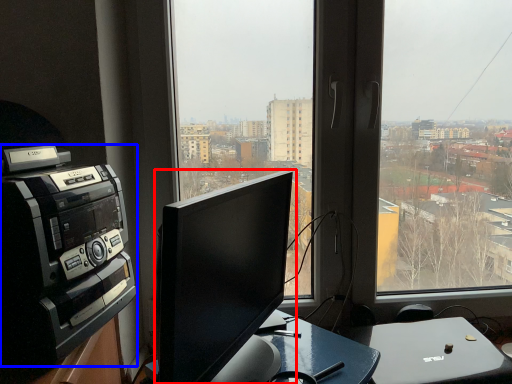
Question: Which point is closer to the camera, computer monitor (highlighted by a red box) or amplifier (highlighted by a blue box)?

Choices:
 (A) computer monitor
 (B) amplifier

Answer: (A)